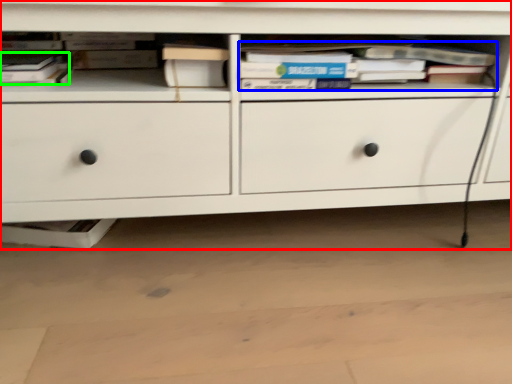
Question: Which object is the closest to the chest of drawers (highlighted by a red box)? Choose among these: book (highlighted by a blue box) or book (highlighted by a green box).

Choices:
 (A) book
 (B) book

Answer: (A)